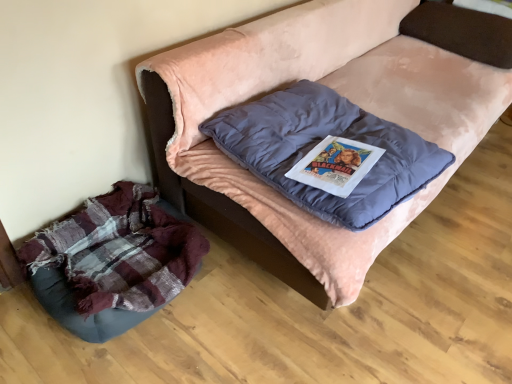
What are the coordinates of `spots to the right of plaid fabric dog bed at lower left` in the screenshot? It's located at (232, 311).